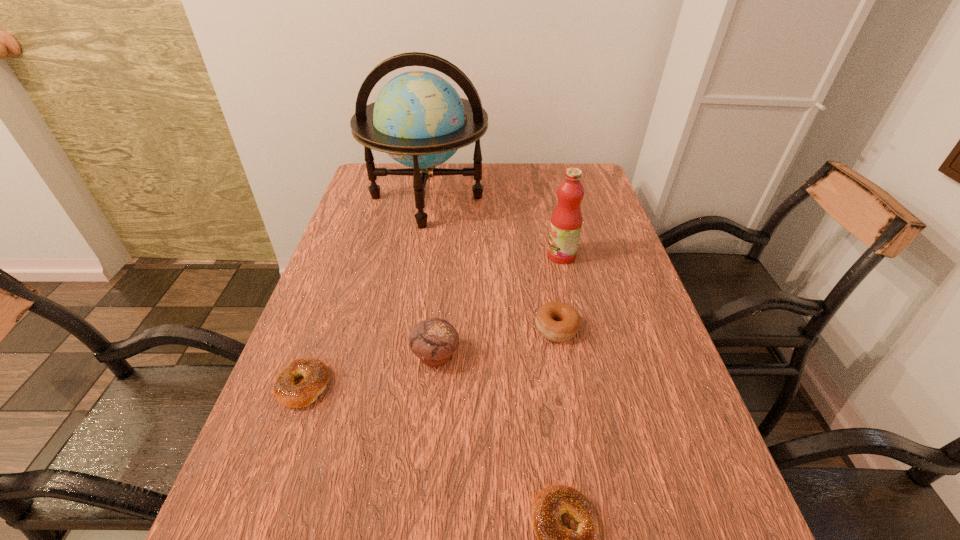
The height and width of the screenshot is (540, 960). Find the location of `free space at the far edge of the desktop`. free space at the far edge of the desktop is located at coordinates (459, 165).

The height and width of the screenshot is (540, 960). I want to click on vacant space at the left edge of the desktop, so click(x=340, y=262).

This screenshot has height=540, width=960. In order to click on vacant space at the right edge of the desktop in this screenshot , I will do `click(607, 322)`.

At what (x,y) coordinates should I click in order to perform the action: click on vacant space at the far left corner. Please return your answer as a coordinate pair (x, y). The image size is (960, 540). Looking at the image, I should click on (386, 189).

Identify the location of vacant point located between the fifth nearest object and the tallest bagel. (559, 292).

The height and width of the screenshot is (540, 960). What are the coordinates of `vacant space that's between the fifth nearest object and the farthest object` in the screenshot? It's located at (494, 226).

The image size is (960, 540). In order to click on vacant area between the globe and the second farthest bagel in this screenshot , I will do `click(366, 291)`.

Locate an element on the screen. The width and height of the screenshot is (960, 540). empty space that is in between the fourth shortest object and the farthest bagel is located at coordinates (496, 342).

Find the location of a particular element. This screenshot has height=540, width=960. free point between the tallest bagel and the second tallest object is located at coordinates (559, 292).

Where is `vacant space that's between the fifth nearest object and the fourth shortest object`? Image resolution: width=960 pixels, height=540 pixels. vacant space that's between the fifth nearest object and the fourth shortest object is located at coordinates (498, 305).